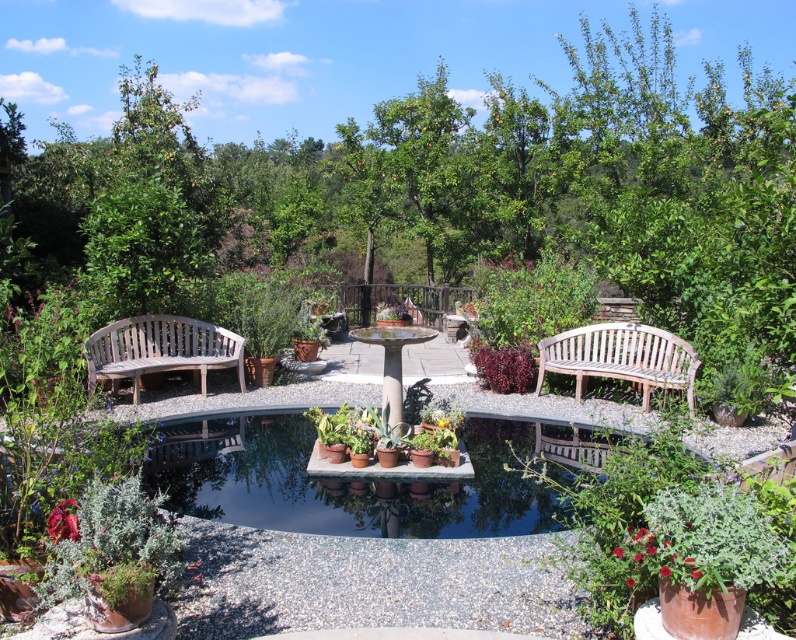
Looking at this image, can you confirm if green textured plant at lower left is shorter than wooden bench at left?

Yes.

Is point (80, 579) less distant than point (121, 337)?

Yes, it is in front of point (121, 337).

Find the location of a particular element. The height and width of the screenshot is (640, 796). green textured plant at lower left is located at coordinates (116, 556).

Can you confirm if wooden bench at right is positioned below green matte potted plants at center?

No.

Which of these two, wooden bench at right or green matte potted plants at center, stands taller?

With more height is wooden bench at right.

Is point (586, 353) closer to viewer compared to point (356, 413)?

No, (586, 353) is behind (356, 413).

Identify the location of wooden bench at right. Image resolution: width=796 pixels, height=640 pixels. (621, 356).

Is green textured plant at lower left to the right of green matte potted plants at center from the viewer's perspective?

Incorrect, green textured plant at lower left is not on the right side of green matte potted plants at center.

Which of these two, green textured plant at lower left or green matte potted plants at center, stands shorter?

Standing shorter between the two is green matte potted plants at center.

Identify the location of green textured plant at lower left. (116, 556).

At what (x,y) coordinates should I click in order to perform the action: click on green textured plant at lower left. Please return your answer as a coordinate pair (x, y). Image resolution: width=796 pixels, height=640 pixels. Looking at the image, I should click on (116, 556).